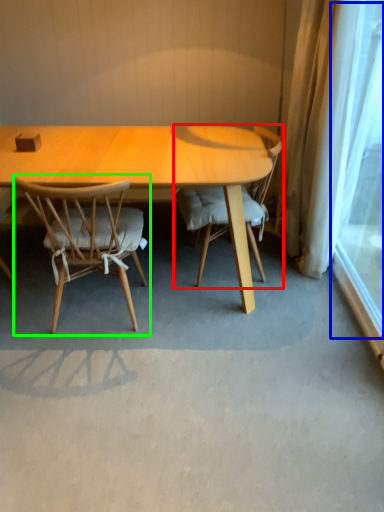
Question: Which object is the farthest from chair (highlighted by a red box)? Choose among these: window screen (highlighted by a blue box) or chair (highlighted by a green box).

Choices:
 (A) window screen
 (B) chair

Answer: (A)